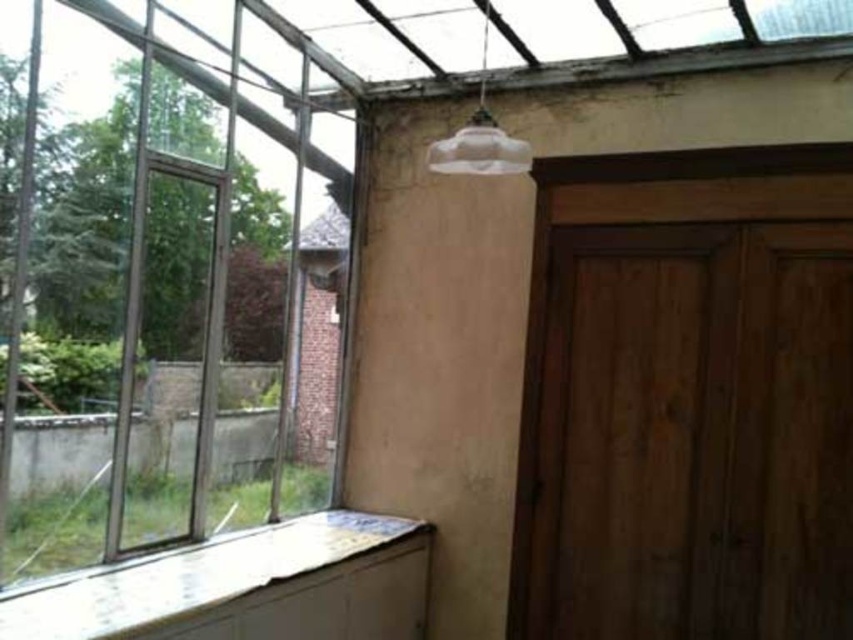
Can you confirm if white painted wood at lower left is taller than translucent glass lampshade at upper center?

Yes, white painted wood at lower left is taller than translucent glass lampshade at upper center.

From the picture: Is white painted wood at lower left smaller than translucent glass lampshade at upper center?

Actually, white painted wood at lower left might be larger than translucent glass lampshade at upper center.

Where is `white painted wood at lower left`? The width and height of the screenshot is (853, 640). white painted wood at lower left is located at coordinates [247, 588].

Is clear glass window at left shorter than white painted wood at lower left?

Incorrect, clear glass window at left's height does not fall short of white painted wood at lower left's.

At what (x,y) coordinates should I click in order to perform the action: click on clear glass window at left. Please return your answer as a coordinate pair (x, y). Looking at the image, I should click on [160, 301].

Can you confirm if clear glass window at left is wider than translucent glass lampshade at upper center?

Correct, the width of clear glass window at left exceeds that of translucent glass lampshade at upper center.

Is clear glass window at left positioned at the back of translucent glass lampshade at upper center?

No, it is not.

You are a GUI agent. You are given a task and a screenshot of the screen. Output one action in this format:
    pyautogui.click(x=<x>, y=<y>)
    Task: Click on the clear glass window at left
    
    Given the screenshot: What is the action you would take?
    (x=160, y=301)

Identify the location of clear glass window at left. The image size is (853, 640). (160, 301).